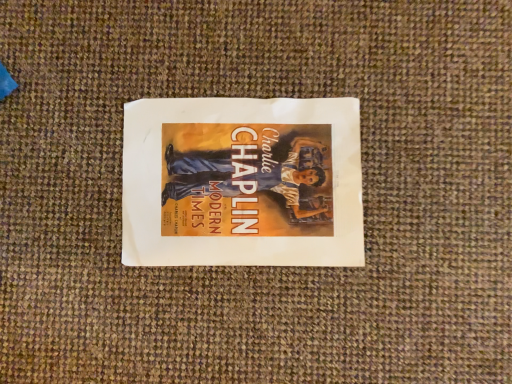
This screenshot has height=384, width=512. Identify the location of matte paper poster at center. (242, 182).

What is the approximate width of matte paper poster at center?

It is 12.02 inches.

Describe the element at coordinates (242, 182) in the screenshot. I see `matte paper poster at center` at that location.

The height and width of the screenshot is (384, 512). In order to click on matte paper poster at center in this screenshot , I will do `click(242, 182)`.